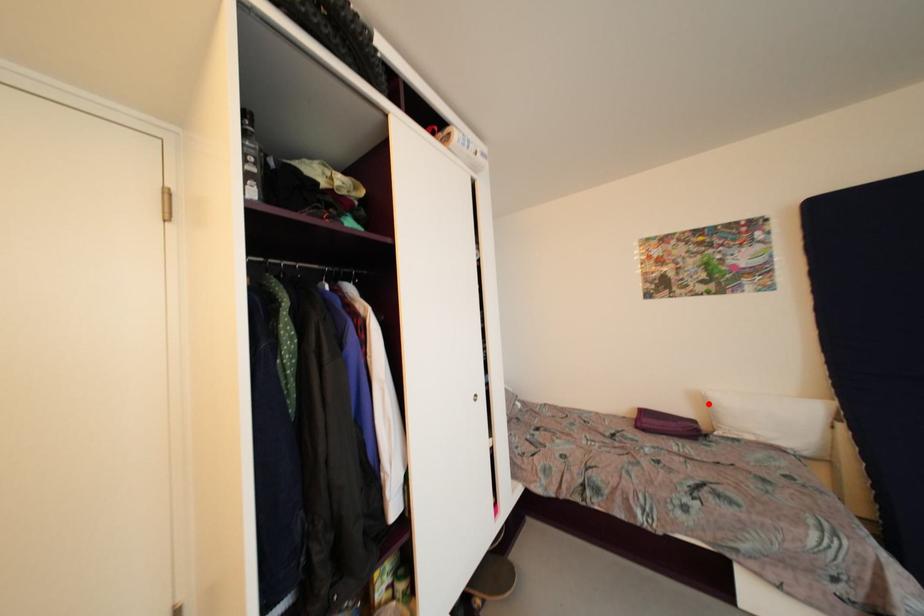
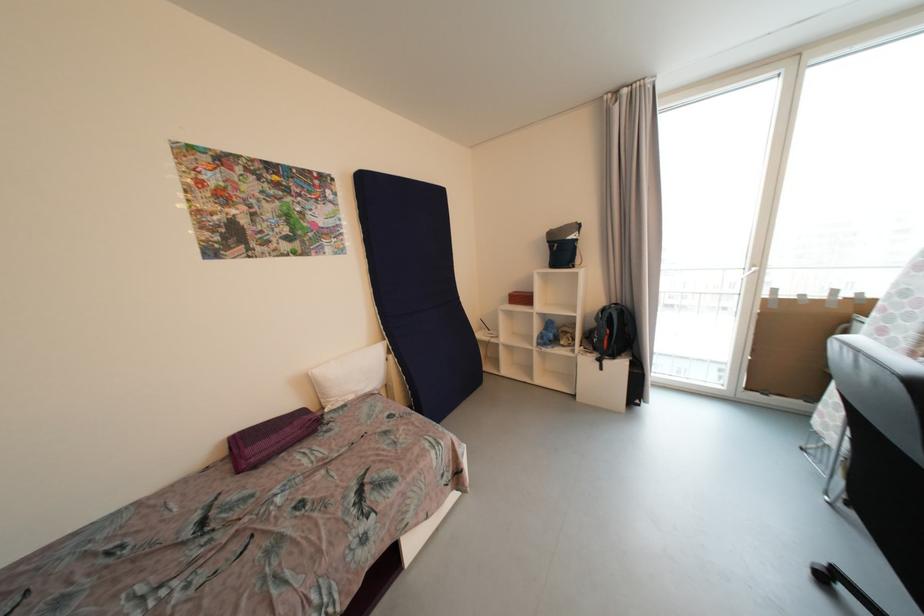
Locate, in the second image, the point that corresponds to the highlighted location in the first image.

(315, 386)